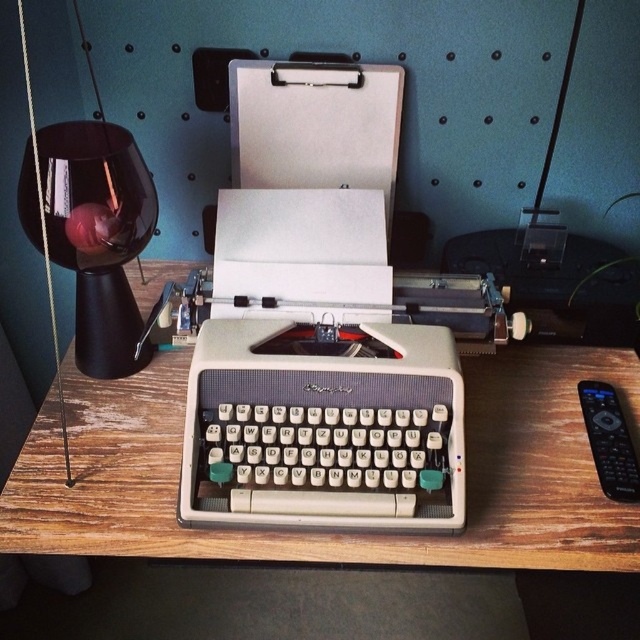
Question: Based on their relative distances, which object is nearer to the wooden table at center?

Choices:
 (A) black glass table lamp at left
 (B) black plastic remote at right

Answer: (A)

Question: Does wooden table at center lie in front of black glass table lamp at left?

Choices:
 (A) no
 (B) yes

Answer: (A)

Question: Can you confirm if wooden table at center is positioned to the left of black glass table lamp at left?

Choices:
 (A) no
 (B) yes

Answer: (A)

Question: Among these points, which one is nearest to the camera?

Choices:
 (A) (172, 381)
 (B) (84, 237)

Answer: (B)

Question: Does black glass table lamp at left have a lesser width compared to black plastic remote at right?

Choices:
 (A) yes
 (B) no

Answer: (B)

Question: Among these objects, which one is farthest from the camera?

Choices:
 (A) black plastic remote at right
 (B) black glass table lamp at left
 (C) wooden table at center

Answer: (A)